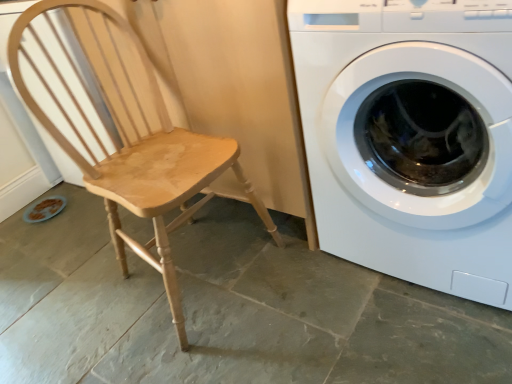
This screenshot has height=384, width=512. I want to click on free spot below light wood chair at left (from a real-world perspective), so click(x=199, y=277).